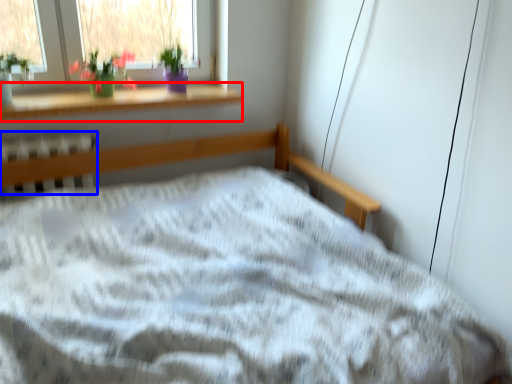
Question: Which of the following is the closest to the observer, window sill (highlighted by a red box) or radiator (highlighted by a blue box)?

Choices:
 (A) window sill
 (B) radiator

Answer: (B)